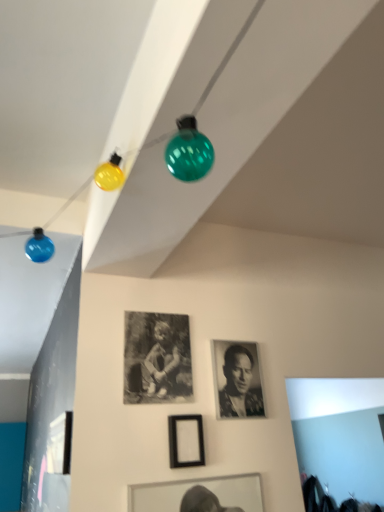
Question: Does point [125, 335] appear closer or farther from the camera than point [251, 392]?

Choices:
 (A) closer
 (B) farther

Answer: (A)

Question: Based on their positions, is black matte photo frame at center, which is counted as the second picture frame, starting from the left, located to the left or right of black and white photograph at center?

Choices:
 (A) left
 (B) right

Answer: (A)

Question: Which object is positioned farthest from the black matte photo frame at center, which is counted as the 2th picture frame, starting from the right?

Choices:
 (A) black matte picture frame at center, arranged as the 3th picture frame when viewed from the left
 (B) black and white photograph at center
 (C) matte black picture frame at lower left, which is the first picture frame in left-to-right order

Answer: (C)

Question: Estimate the real-world distances between objects in this image. Which object is closer to the black and white photograph at center?

Choices:
 (A) black matte picture frame at center, positioned as the 1th picture frame in right-to-left order
 (B) matte black picture frame at lower left, which is the first picture frame in left-to-right order
 (C) black matte photo frame at center, which is counted as the second picture frame, starting from the left

Answer: (A)